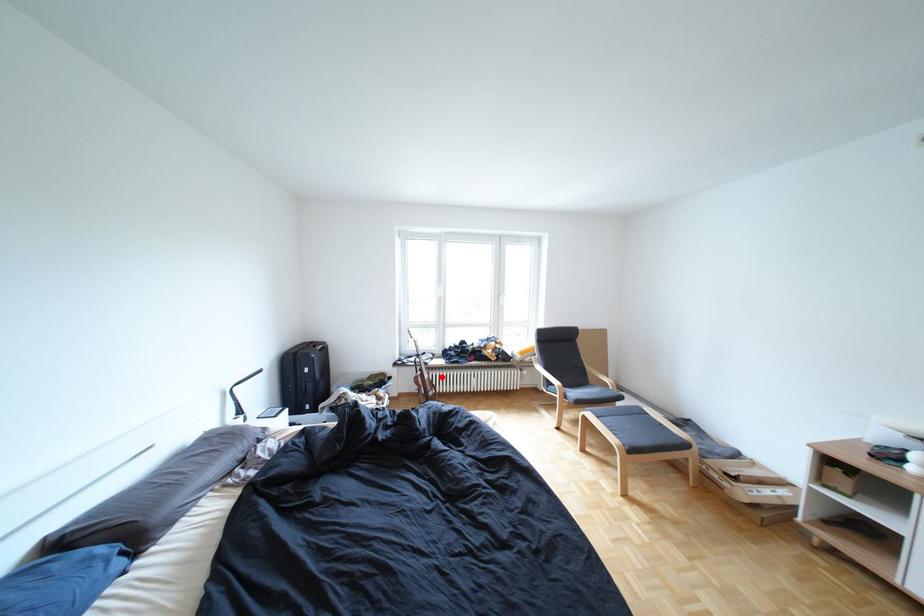
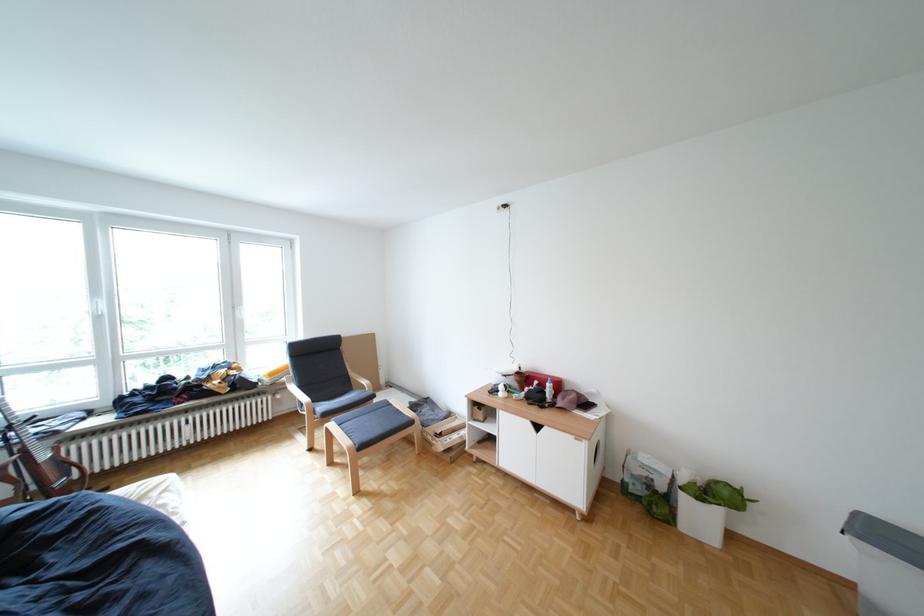
Question: I am providing you with two images of the same scene from different viewpoints. A red point is shown in image1. For the corresponding object point in image2, is it positioned nearer or farther from the camera?

Choices:
 (A) Nearer
 (B) Farther

Answer: (A)